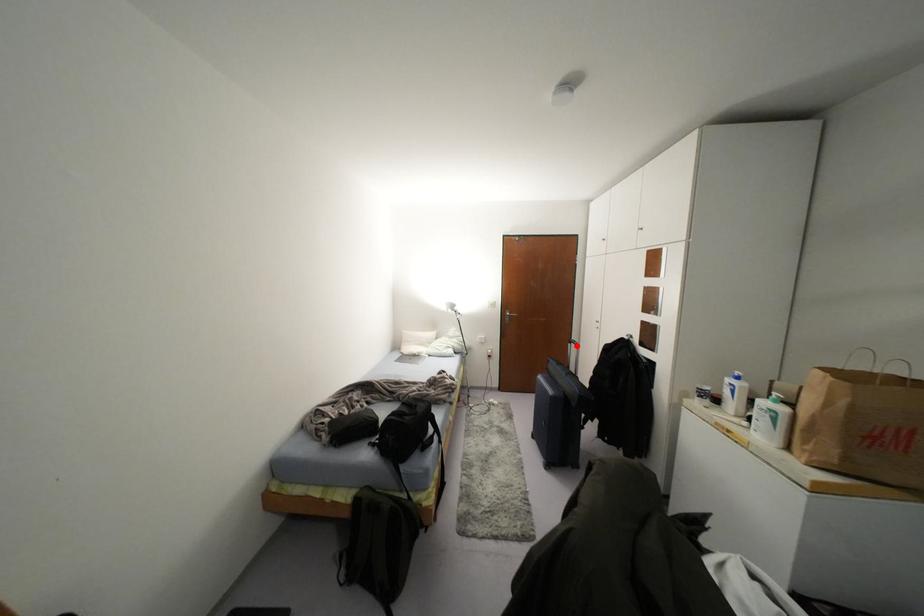
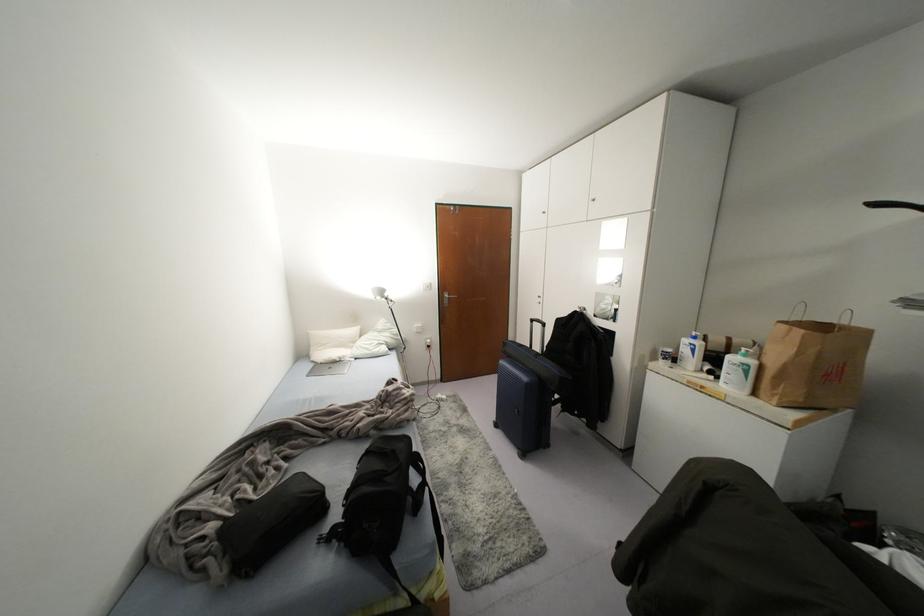
The point at the highlighted location is marked in the first image. Where is the corresponding point in the second image?

(542, 323)